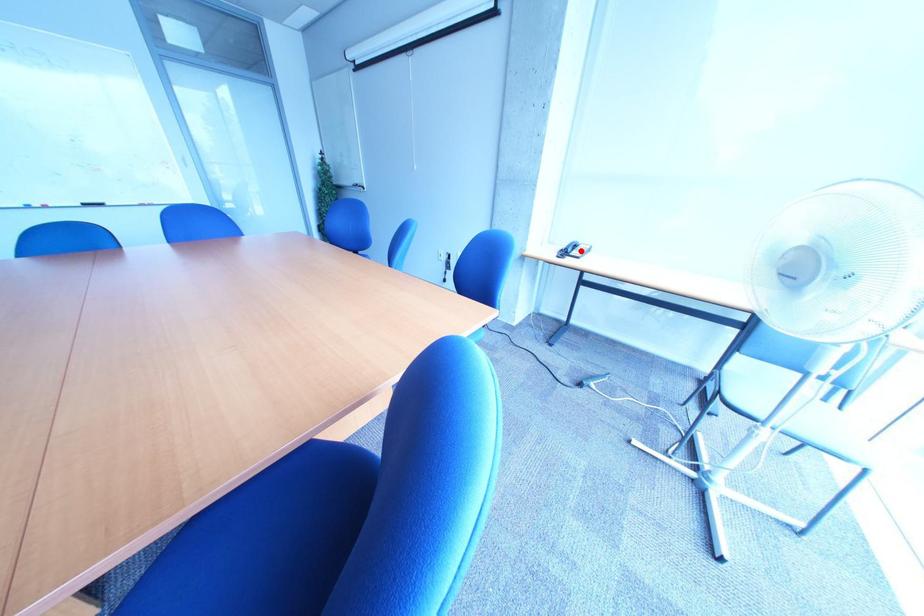
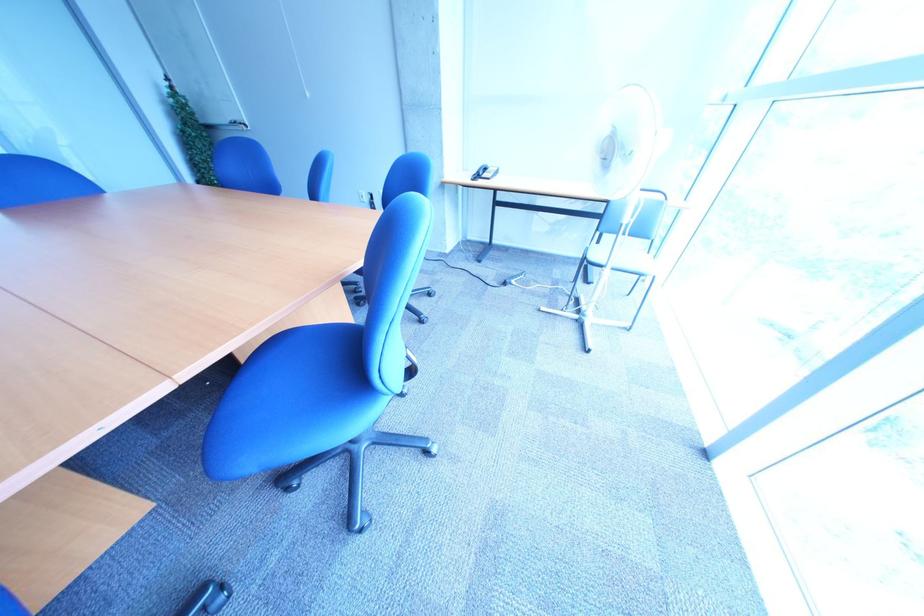
In the second image, find the point that corresponds to the highlighted location in the first image.

(492, 174)